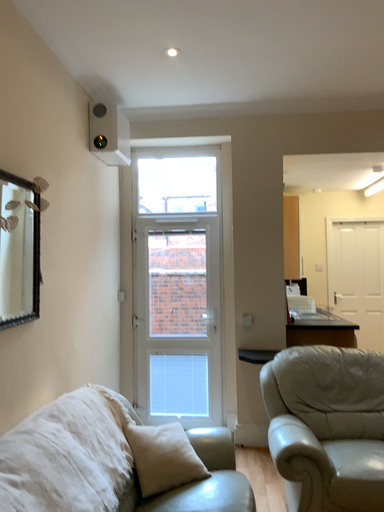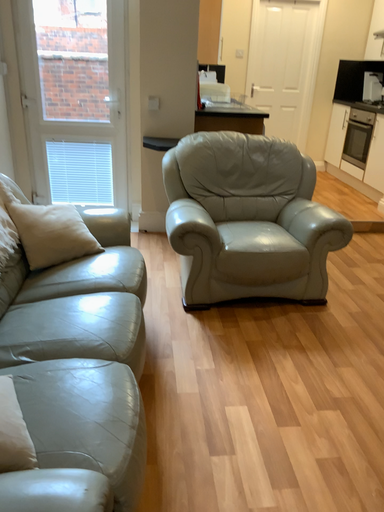
Question: Which way did the camera rotate in the video?

Choices:
 (A) rotated left
 (B) rotated right

Answer: (B)